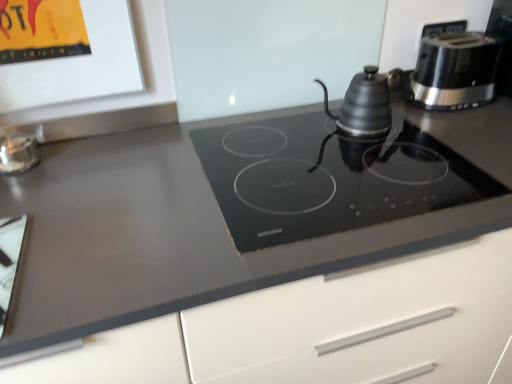
The image size is (512, 384). What are the coordinates of `free space to the right of white glossy cutting board at lower left, marked as the second appliance in a back-to-front arrangement` in the screenshot? It's located at (100, 249).